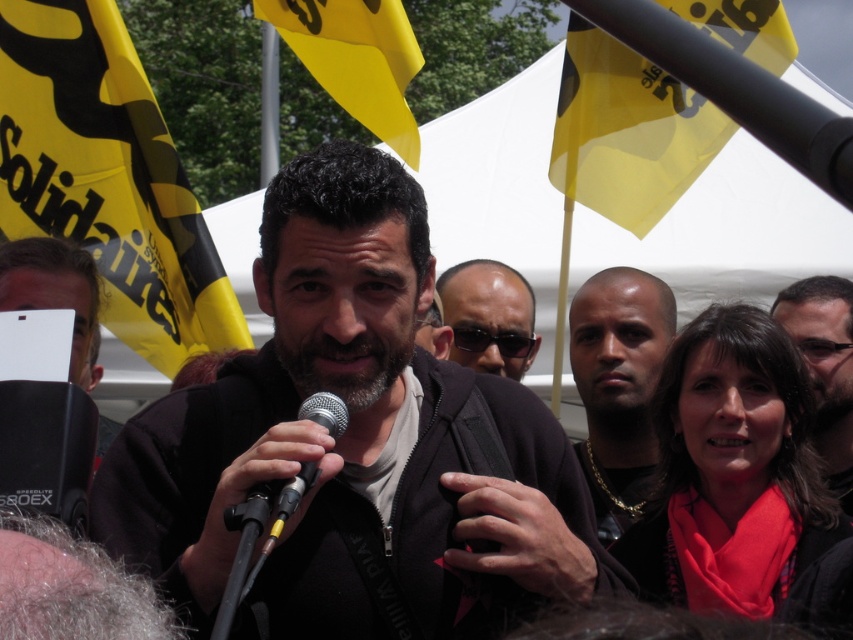
Who is positioned more to the left, yellow fabric flag at upper left or matte black hair at upper right?

yellow fabric flag at upper left

Does yellow fabric flag at upper left appear under matte black hair at upper right?

Incorrect, yellow fabric flag at upper left is not positioned below matte black hair at upper right.

Does point (61, 120) come farther from viewer compared to point (822, 348)?

Yes, point (61, 120) is farther from viewer.

The width and height of the screenshot is (853, 640). Find the location of `yellow fabric flag at upper left`. yellow fabric flag at upper left is located at coordinates coord(107,179).

Which of these two, yellow fabric flag at upper center or white plastic sign at lower left, stands shorter?

With less height is yellow fabric flag at upper center.

Is yellow fabric flag at upper center positioned behind white plastic sign at lower left?

Yes.

Between point (376, 36) and point (10, 252), which one is positioned in front?

Point (10, 252) is more forward.

In order to click on yellow fabric flag at upper center in this screenshot , I will do `click(357, 60)`.

Is yellow fabric flag at upper center to the left of matte black hair at upper right from the viewer's perspective?

Indeed, yellow fabric flag at upper center is positioned on the left side of matte black hair at upper right.

Is yellow fabric flag at upper center thinner than matte black hair at upper right?

No, yellow fabric flag at upper center is not thinner than matte black hair at upper right.

Which is behind, point (399, 72) or point (822, 275)?

Positioned behind is point (822, 275).

Image resolution: width=853 pixels, height=640 pixels. I want to click on yellow fabric flag at upper center, so click(357, 60).